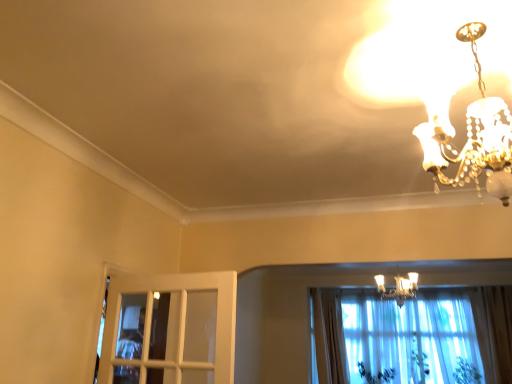
Question: Is light beige fabric curtain at lower center closer to the viewer compared to green leafy plant at lower right, the first plant viewed from the right?

Choices:
 (A) yes
 (B) no

Answer: (A)

Question: Does light beige fabric curtain at lower center touch green leafy plant at lower right, arranged as the 3th plant when viewed from the left?

Choices:
 (A) yes
 (B) no

Answer: (B)

Question: Is green leafy plant at lower right, arranged as the 3th plant when viewed from the left, at the back of light beige fabric curtain at lower center?

Choices:
 (A) no
 (B) yes

Answer: (A)

Question: Does light beige fabric curtain at lower center have a greater height compared to green leafy plant at lower right, the first plant viewed from the right?

Choices:
 (A) no
 (B) yes

Answer: (B)

Question: Is light beige fabric curtain at lower center not within green leafy plant at lower right, the first plant viewed from the right?

Choices:
 (A) yes
 (B) no

Answer: (A)

Question: Is light beige fabric curtain at lower center bigger than green leafy plant at lower right, arranged as the 3th plant when viewed from the left?

Choices:
 (A) yes
 (B) no

Answer: (A)

Question: Is light beige fabric curtain at lower center looking in the opposite direction of green leafy plant at lower right, arranged as the first plant when viewed from the left?

Choices:
 (A) yes
 (B) no

Answer: (B)

Question: Are light beige fabric curtain at lower center and green leafy plant at lower right, arranged as the first plant when viewed from the left, located far from each other?

Choices:
 (A) no
 (B) yes

Answer: (A)

Question: Is green leafy plant at lower right, placed as the third plant when sorted from right to left, surrounded by light beige fabric curtain at lower center?

Choices:
 (A) no
 (B) yes

Answer: (A)

Question: From the image's perspective, is light beige fabric curtain at lower center on green leafy plant at lower right, arranged as the first plant when viewed from the left?

Choices:
 (A) yes
 (B) no

Answer: (A)

Question: Is light beige fabric curtain at lower center to the right of green leafy plant at lower right, arranged as the first plant when viewed from the left, from the viewer's perspective?

Choices:
 (A) yes
 (B) no

Answer: (B)

Question: Can you confirm if light beige fabric curtain at lower center is bigger than green leafy plant at lower right, arranged as the first plant when viewed from the left?

Choices:
 (A) yes
 (B) no

Answer: (A)

Question: Does green leafy plant at lower right, arranged as the 3th plant when viewed from the left, turn towards green leafy plant at lower right, which ranks as the 2th plant in left-to-right order?

Choices:
 (A) no
 (B) yes

Answer: (A)